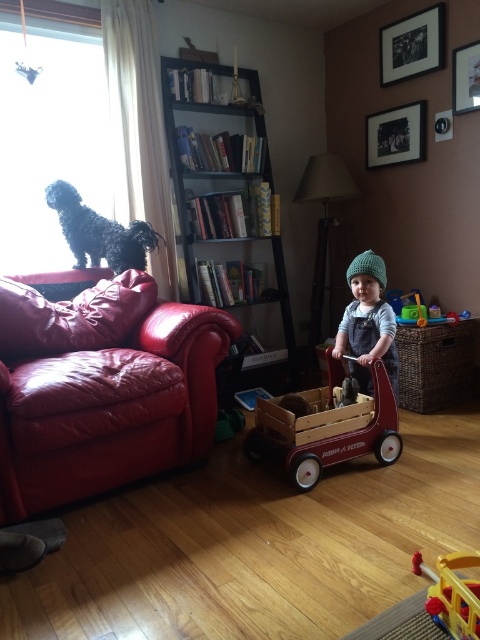
Question: Among these objects, which one is farthest from the camera?

Choices:
 (A) translucent plastic toy at center
 (B) rubberized plastic walker at lower right

Answer: (A)

Question: Which point is farther from the camera taking this photo?

Choices:
 (A) (384, 28)
 (B) (108, 221)
 (C) (469, 106)
 (D) (389, 355)

Answer: (A)

Question: Can you confirm if green knitted hat at center is bigger than wooden picture frame at upper right?

Choices:
 (A) yes
 (B) no

Answer: (A)

Question: Can you confirm if wooden wagon at center is smaller than translucent plastic toy at center?

Choices:
 (A) yes
 (B) no

Answer: (B)

Question: Is metallic silver picture frame at upper right bigger than wooden picture frame at upper right?

Choices:
 (A) yes
 (B) no

Answer: (A)

Question: Which object is farther from the camera taking this photo?

Choices:
 (A) metallic silver picture frame at upper right
 (B) wooden picture frame at upper right
 (C) leather couch at left
 (D) black matte bookshelf at upper center

Answer: (D)